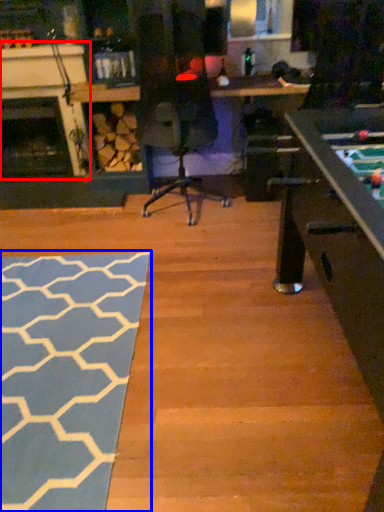
Question: Which of the following is the farthest to the observer, fireplace (highlighted by a red box) or mat (highlighted by a blue box)?

Choices:
 (A) fireplace
 (B) mat

Answer: (A)